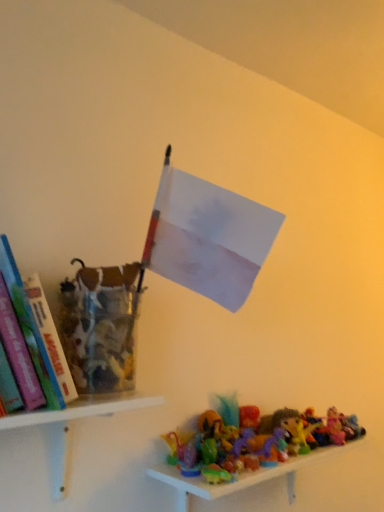
Question: From a real-world perspective, is white plastic shelf at lower left, the first shelf positioned from the left, positioned over hardcover book at left based on gravity?

Choices:
 (A) no
 (B) yes

Answer: (A)

Question: Does white plastic shelf at lower left, the first shelf positioned from the left, touch hardcover book at left?

Choices:
 (A) no
 (B) yes

Answer: (A)

Question: From the image's perspective, does white plastic shelf at lower left, the first shelf positioned from the left, appear lower than hardcover book at left?

Choices:
 (A) no
 (B) yes

Answer: (B)

Question: Is white plastic shelf at lower left, which ranks as the second shelf in bottom-to-top order, looking in the opposite direction of hardcover book at left?

Choices:
 (A) yes
 (B) no

Answer: (B)

Question: Could hardcover book at left be considered to be inside white plastic shelf at lower left, the first shelf when ordered from top to bottom?

Choices:
 (A) no
 (B) yes

Answer: (A)

Question: Considering the positions of point (3, 273) and point (61, 487), is point (3, 273) closer or farther from the camera than point (61, 487)?

Choices:
 (A) farther
 (B) closer

Answer: (B)

Question: Is hardcover book at left taller or shorter than white plastic shelf at lower left, acting as the 2th shelf starting from the right?

Choices:
 (A) short
 (B) tall

Answer: (B)

Question: Is hardcover book at left to the left or to the right of white plastic shelf at lower left, the first shelf positioned from the left, in the image?

Choices:
 (A) left
 (B) right

Answer: (A)

Question: Relative to white plastic shelf at lower left, acting as the 2th shelf starting from the right, is hardcover book at left in front or behind?

Choices:
 (A) behind
 (B) front

Answer: (B)

Question: In terms of height, does translucent plastic toys at lower right, which is the 1th shelf from right to left, look taller or shorter compared to hardcover book at left?

Choices:
 (A) tall
 (B) short

Answer: (B)

Question: From the image's perspective, relative to hardcover book at left, is translucent plastic toys at lower right, positioned as the first shelf in bottom-to-top order, above or below?

Choices:
 (A) above
 (B) below

Answer: (B)

Question: Relative to hardcover book at left, is translucent plastic toys at lower right, positioned as the first shelf in bottom-to-top order, in front or behind?

Choices:
 (A) front
 (B) behind

Answer: (B)

Question: Considering the positions of translucent plastic toys at lower right, which is the second shelf in left-to-right order, and hardcover book at left in the image, is translucent plastic toys at lower right, which is the second shelf in left-to-right order, wider or thinner than hardcover book at left?

Choices:
 (A) wide
 (B) thin

Answer: (B)

Question: Is point (34, 351) closer or farther from the camera than point (206, 490)?

Choices:
 (A) farther
 (B) closer

Answer: (B)

Question: Is hardcover book at left in front of or behind translucent plastic toys at lower right, marked as the 2th shelf in a top-to-bottom arrangement, in the image?

Choices:
 (A) front
 (B) behind

Answer: (A)